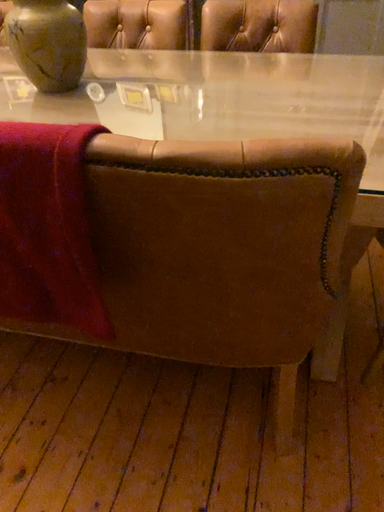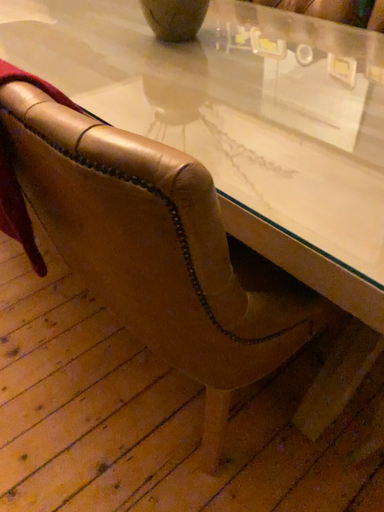
Question: How did the camera likely rotate when shooting the video?

Choices:
 (A) rotated right
 (B) rotated left

Answer: (B)